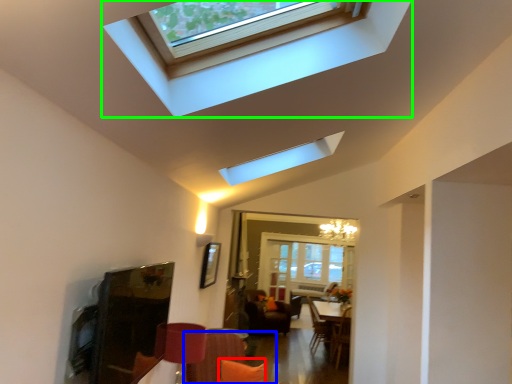
Question: Based on their relative distances, which object is farther from pillow (highlighted by a red box)? Choose from couch (highlighted by a blue box) and window (highlighted by a green box).

Choices:
 (A) couch
 (B) window

Answer: (B)